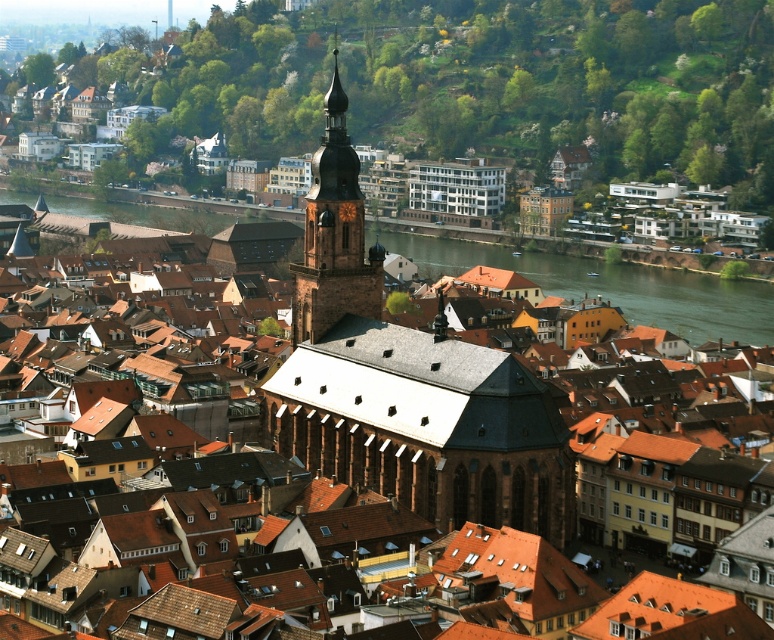
Can you confirm if brown stone church at center is positioned to the left of brown stone bell tower at center?

In fact, brown stone church at center is to the right of brown stone bell tower at center.

Based on the photo, how distant is brown stone church at center from brown stone bell tower at center?

The distance of brown stone church at center from brown stone bell tower at center is 44.65 feet.

Identify the location of brown stone church at center. (406, 384).

Does point (632, 307) come in front of point (300, 282)?

No, (632, 307) is further to viewer.

Can you confirm if green water at center is positioned below brown stone bell tower at center?

Indeed, green water at center is positioned under brown stone bell tower at center.

Describe the element at coordinates (615, 285) in the screenshot. The image size is (774, 640). I see `green water at center` at that location.

At what (x,y) coordinates should I click in order to perform the action: click on green water at center. Please return your answer as a coordinate pair (x, y). Looking at the image, I should click on (615, 285).

Which is behind, point (355, 285) or point (740, 308)?

The point (740, 308) is behind.

Which is in front, point (557, 508) or point (622, 298)?

Point (557, 508) is in front.

The image size is (774, 640). I want to click on brown stone church at center, so click(x=406, y=384).